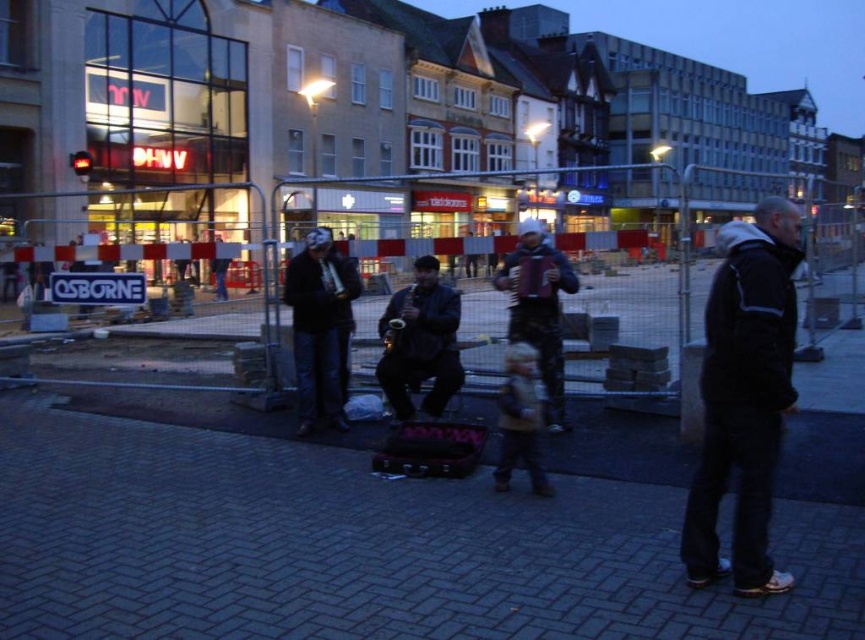
Between point (146, 560) and point (739, 486), which one is positioned behind?

Point (146, 560)

Is dark brick pavement at lower center in front of black matte jacket at right?

Yes, dark brick pavement at lower center is in front of black matte jacket at right.

Is point (425, 570) more distant than point (719, 369)?

Yes, it is.

What are the coordinates of `dark brick pavement at lower center` in the screenshot? It's located at (362, 547).

Does dark brick pavement at lower center appear over matte black mask at center?

Incorrect, dark brick pavement at lower center is not positioned above matte black mask at center.

At what (x,y) coordinates should I click in order to perform the action: click on dark brick pavement at lower center. Please return your answer as a coordinate pair (x, y). Looking at the image, I should click on (362, 547).

Who is more forward, (362, 518) or (317, 273)?

Point (362, 518) is in front.

You are a GUI agent. You are given a task and a screenshot of the screen. Output one action in this format:
    pyautogui.click(x=<x>, y=<y>)
    Task: Click on the dark brick pavement at lower center
    The height and width of the screenshot is (640, 865).
    Given the screenshot: What is the action you would take?
    pyautogui.click(x=362, y=547)

Is black matte jacket at right positioned behind dark blue leather jacket at center?

That is False.

Which is in front, point (742, 278) or point (411, 344)?

Point (742, 278) is in front.

Identify the location of black matte jacket at right. Image resolution: width=865 pixels, height=640 pixels. (744, 396).